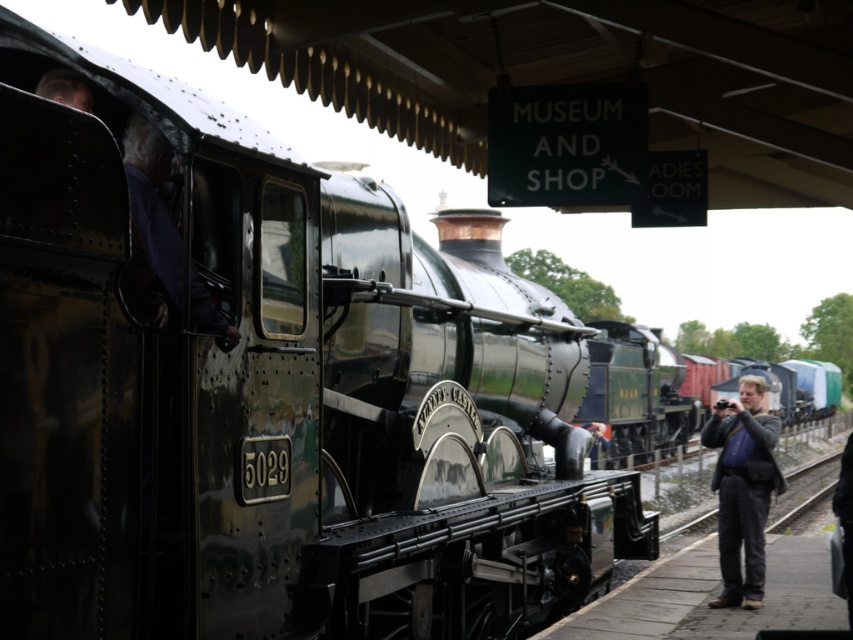
Question: Can you confirm if dark gray jacket at right is positioned above purple fabric at center?

Choices:
 (A) yes
 (B) no

Answer: (B)

Question: Which object appears farthest from the camera in this image?

Choices:
 (A) dark gray jacket at right
 (B) purple fabric at center

Answer: (A)

Question: Among these points, which one is farthest from the camera?

Choices:
 (A) (757, 384)
 (B) (144, 275)

Answer: (A)

Question: Is dark gray jacket at right above purple fabric at center?

Choices:
 (A) no
 (B) yes

Answer: (A)

Question: Which of the following is the farthest from the observer?

Choices:
 (A) (173, 300)
 (B) (747, 380)

Answer: (B)

Question: Is dark gray jacket at right positioned behind purple fabric at center?

Choices:
 (A) yes
 (B) no

Answer: (A)